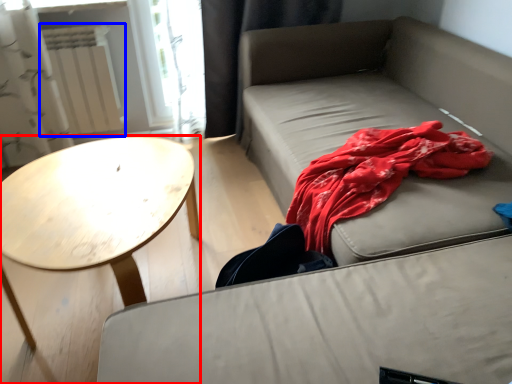
Question: Which object is closer to the camera taking this photo, coffee table (highlighted by a red box) or radiator (highlighted by a blue box)?

Choices:
 (A) coffee table
 (B) radiator

Answer: (A)